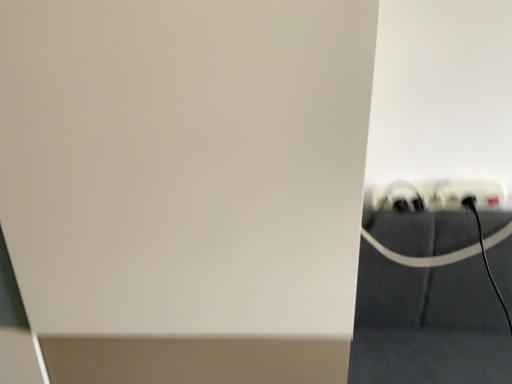
The height and width of the screenshot is (384, 512). I want to click on white plastic power plugs and sockets at lower right, so click(x=469, y=202).

The height and width of the screenshot is (384, 512). Describe the element at coordinates (469, 202) in the screenshot. I see `white plastic power plugs and sockets at lower right` at that location.

This screenshot has height=384, width=512. What are the coordinates of `white plastic power plugs and sockets at lower right` in the screenshot? It's located at (469, 202).